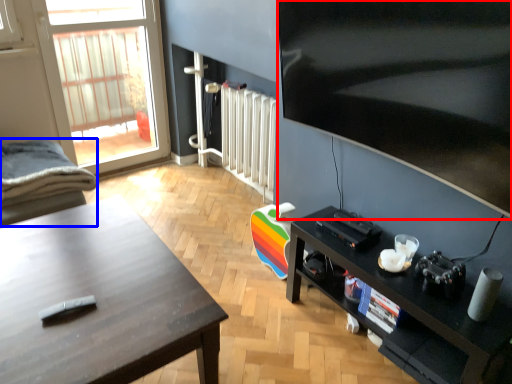
Question: Which object appears farthest to the camera in this image, television (highlighted by a red box) or chair (highlighted by a blue box)?

Choices:
 (A) television
 (B) chair

Answer: (B)